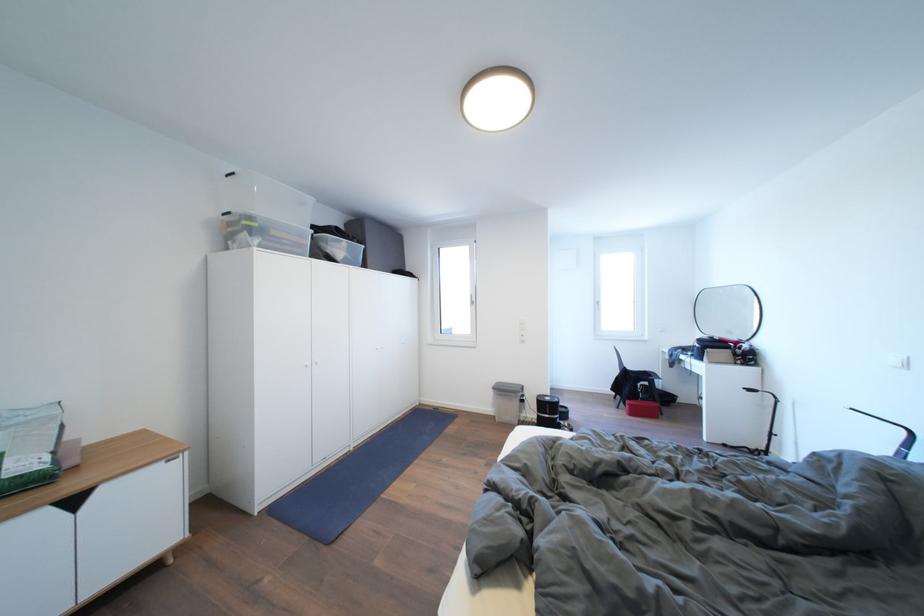
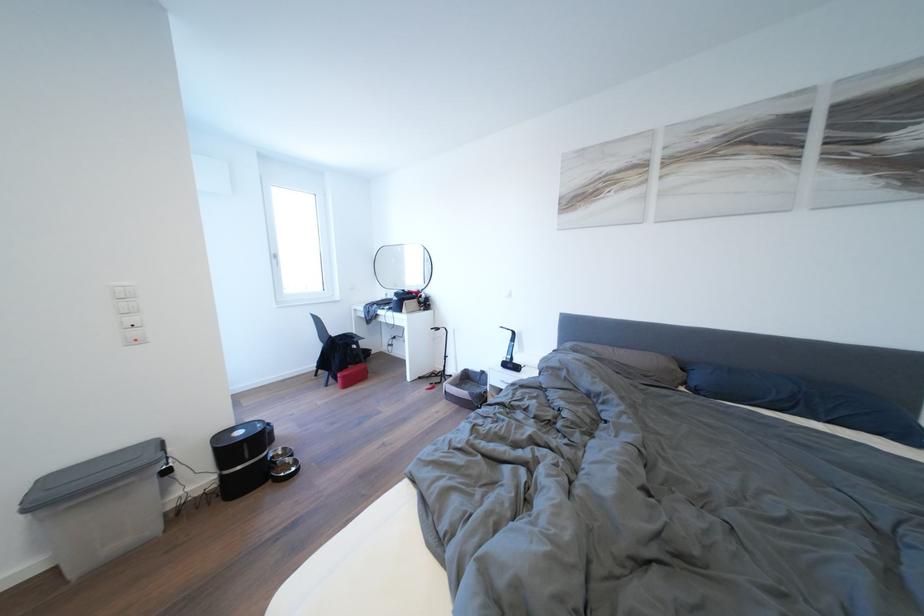
The point at (637, 403) is marked in the first image. Where is the corresponding point in the second image?

(348, 376)